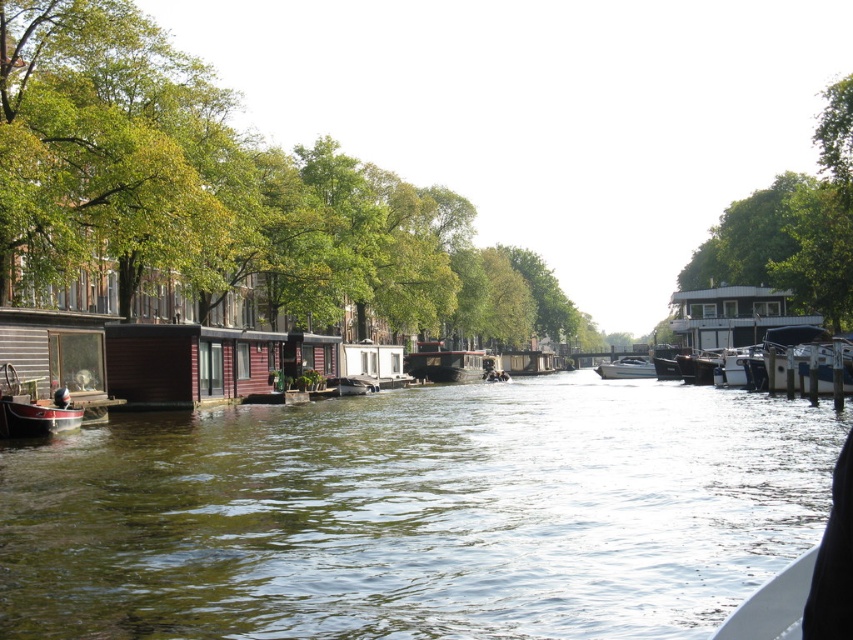
Question: Is green leafy tree at upper left below white glossy houseboat at right?

Choices:
 (A) yes
 (B) no

Answer: (B)

Question: Which of these objects is positioned farthest from the white glossy houseboat at right?

Choices:
 (A) white glossy boat at center
 (B) green water at center
 (C) red polished wood boat at lower left
 (D) green leafy tree at upper left

Answer: (D)

Question: Does wooden cabin cruiser at center have a smaller size compared to white glossy boat at center?

Choices:
 (A) no
 (B) yes

Answer: (B)

Question: Is green water at center closer to the viewer compared to white glossy boat at center?

Choices:
 (A) no
 (B) yes

Answer: (B)

Question: Which point is closer to the camera?

Choices:
 (A) (473, 612)
 (B) (838, 339)

Answer: (A)

Question: Which object is farther from the camera taking this photo?

Choices:
 (A) green water at center
 (B) green leafy tree at upper left
 (C) red polished wood boat at lower left

Answer: (B)